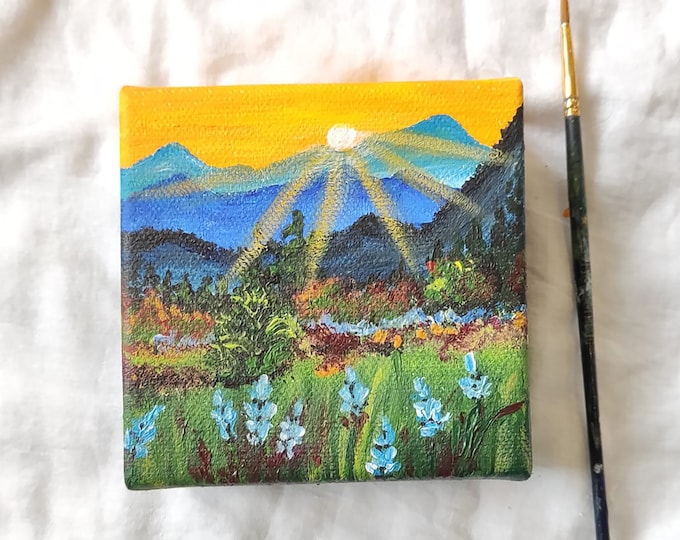
Find the location of a particular element. The height and width of the screenshot is (540, 680). brush part of paintbrush is located at coordinates (564, 8).